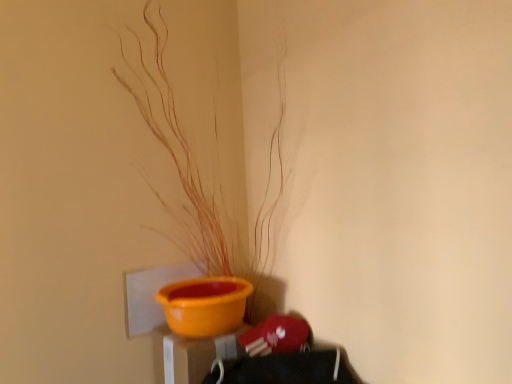
Question: Is orange matte bowl at lower center inside the boundaries of orange matte plant at center, or outside?

Choices:
 (A) outside
 (B) inside

Answer: (A)

Question: Considering their positions, is orange matte bowl at lower center located in front of or behind orange matte plant at center?

Choices:
 (A) behind
 (B) front

Answer: (A)

Question: Based on their sizes in the image, would you say orange matte bowl at lower center is bigger or smaller than orange matte plant at center?

Choices:
 (A) small
 (B) big

Answer: (A)

Question: Considering the positions of orange matte plant at center and orange matte bowl at lower center in the image, is orange matte plant at center taller or shorter than orange matte bowl at lower center?

Choices:
 (A) tall
 (B) short

Answer: (A)

Question: Is point (165, 109) positioned closer to the camera than point (164, 365)?

Choices:
 (A) closer
 (B) farther

Answer: (B)

Question: In the image, is orange matte plant at center on the left side or the right side of orange matte bowl at lower center?

Choices:
 (A) right
 (B) left

Answer: (A)

Question: In terms of size, does orange matte plant at center appear bigger or smaller than orange matte bowl at lower center?

Choices:
 (A) small
 (B) big

Answer: (B)